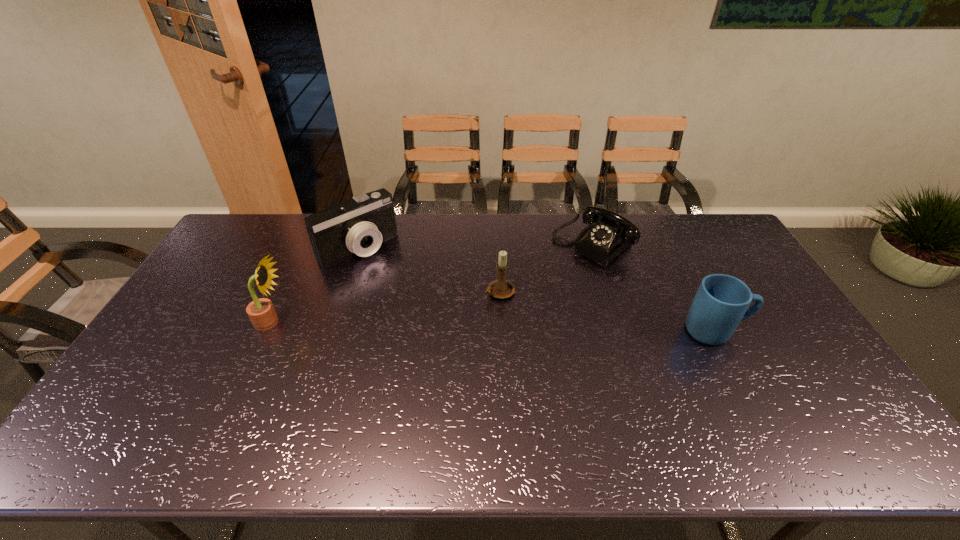
Image resolution: width=960 pixels, height=540 pixels. Identify the location of blank space that satisfies the following two spatial constraints: 1. on the front side of the rightmost object; 2. on the side of the third nearest object with the handle. (502, 331).

You are a GUI agent. You are given a task and a screenshot of the screen. Output one action in this format:
    pyautogui.click(x=<x>, y=<y>)
    Task: Click on the vacant area that satisfies the following two spatial constraints: 1. on the front side of the shortest object; 2. on the side of the mug with the handle
    
    Given the screenshot: What is the action you would take?
    pyautogui.click(x=620, y=331)

At what (x,y) coordinates should I click in order to perform the action: click on free point that satisfies the following two spatial constraints: 1. on the back side of the candle holder; 2. on the left side of the second object from right to left. Please return your answer as a coordinate pair (x, y). This screenshot has height=540, width=960. Looking at the image, I should click on (497, 244).

This screenshot has width=960, height=540. Find the location of `free space that satisfies the following two spatial constraints: 1. on the front side of the second object from left to right; 2. on the side of the rightmost object with the handle`. free space that satisfies the following two spatial constraints: 1. on the front side of the second object from left to right; 2. on the side of the rightmost object with the handle is located at coordinates (331, 331).

Where is `free region that satisfies the following two spatial constraints: 1. on the front side of the mug; 2. on the side of the second object from right to left with the handle`? The image size is (960, 540). free region that satisfies the following two spatial constraints: 1. on the front side of the mug; 2. on the side of the second object from right to left with the handle is located at coordinates (620, 331).

The image size is (960, 540). Find the location of `vacant space that satisfies the following two spatial constraints: 1. on the front side of the second object from left to right; 2. on the side of the rightmost object with the handle`. vacant space that satisfies the following two spatial constraints: 1. on the front side of the second object from left to right; 2. on the side of the rightmost object with the handle is located at coordinates (331, 331).